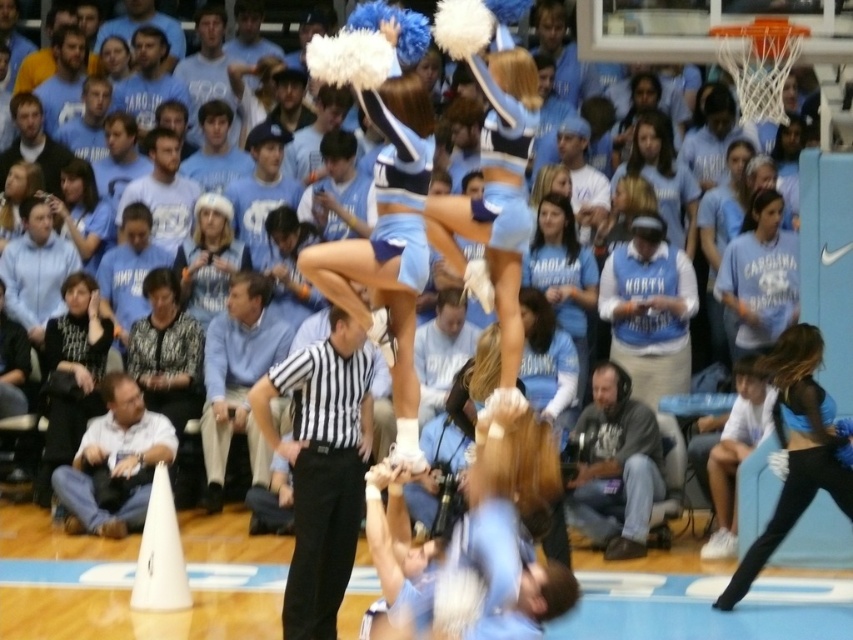
Is point (560, 195) closer to camera compared to point (3, 237)?

Yes.

Can you confirm if light blue jersey at center is smaller than light brown hair at upper left?

No.

At what (x,y) coordinates should I click in order to perform the action: click on light blue jersey at center. Please return your answer as a coordinate pair (x, y). The image size is (853, 640). Looking at the image, I should click on (563, 275).

Find the location of a particular element. light blue fabric cheerleader at center is located at coordinates (490, 172).

From the picture: Who is more forward, (521, 339) or (79, 330)?

Positioned in front is point (521, 339).

Is point (473, 234) positioned before point (61, 358)?

Yes, it is.

You are a GUI agent. You are given a task and a screenshot of the screen. Output one action in this format:
    pyautogui.click(x=<x>, y=<y>)
    Task: Click on the light blue fabric cheerleader at center
    Image resolution: width=853 pixels, height=640 pixels.
    Given the screenshot: What is the action you would take?
    pos(490,172)

Measure the distance between light blue fabric cheerleader at center and camera.

light blue fabric cheerleader at center and camera are 31.01 feet apart.

Which is above, light blue fabric cheerleader at center or black matte cheerleader at right?

light blue fabric cheerleader at center

Locate an element on the screen. light blue fabric cheerleader at center is located at coordinates (490, 172).